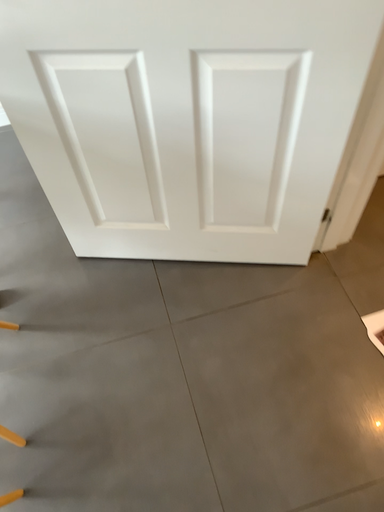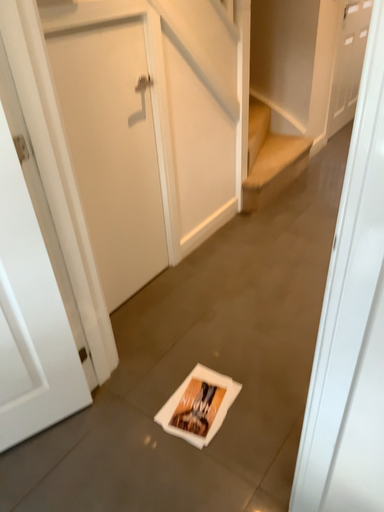
Question: Which way did the camera rotate in the video?

Choices:
 (A) rotated left
 (B) rotated right

Answer: (B)